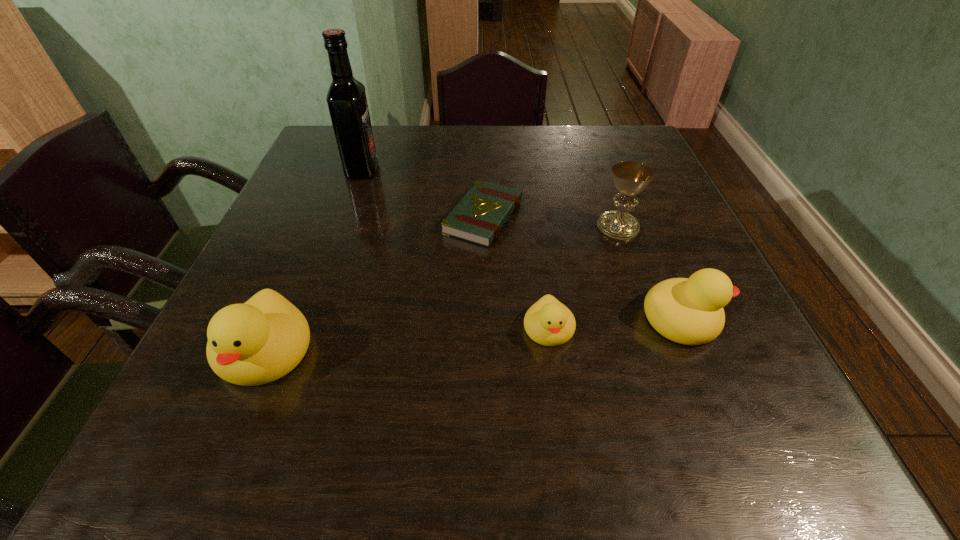
Image resolution: width=960 pixels, height=540 pixels. In order to click on the leftmost duckling in this screenshot , I will do `click(257, 342)`.

Find the location of a particular element. the second duckling from left to right is located at coordinates (548, 322).

The width and height of the screenshot is (960, 540). Identify the location of the shortest duckling. (548, 322).

Locate an element on the screen. This screenshot has width=960, height=540. the rightmost duckling is located at coordinates (690, 311).

At what (x,y) coordinates should I click in order to perform the action: click on the third shortest object. Please return your answer as a coordinate pair (x, y). This screenshot has width=960, height=540. Looking at the image, I should click on (690, 311).

Locate an element on the screen. The width and height of the screenshot is (960, 540). the tallest object is located at coordinates (346, 98).

Image resolution: width=960 pixels, height=540 pixels. What are the coordinates of `liquor` in the screenshot? It's located at (346, 98).

Find the location of a particular element. chalice is located at coordinates (630, 178).

I want to click on the shortest object, so click(x=479, y=216).

You are a GUI agent. You are given a task and a screenshot of the screen. Output one action in this format:
    pyautogui.click(x=<x>, y=<y>)
    Task: Click on the vacant space situated on the face of the shortest duckling
    This screenshot has width=960, height=540.
    Given the screenshot: What is the action you would take?
    pyautogui.click(x=556, y=377)